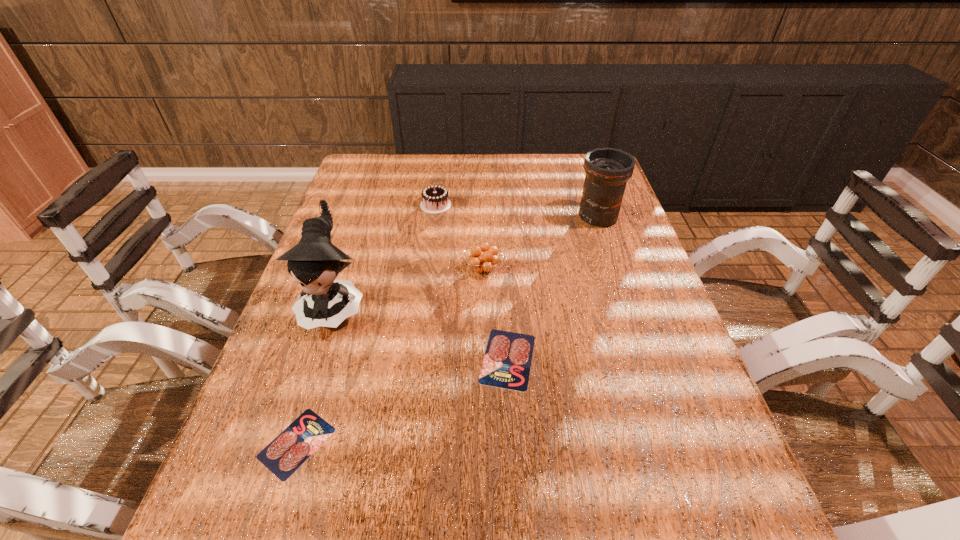
Please point a vacant point for placing a salami on the right. Please provide its 2D coordinates. Your answer should be formatted as a tuple, i.e. [(x, y)], where the tuple contains the x and y coordinates of a point satisfying the conditions above.

[(665, 296)]